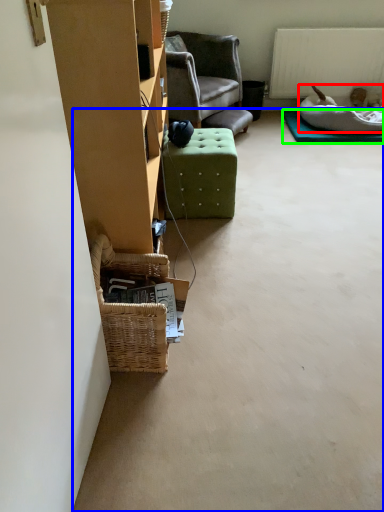
Question: Which object is the farthest from dog bed (highlighted by a red box)? Choose among these: concrete (highlighted by a blue box) or mat (highlighted by a green box).

Choices:
 (A) concrete
 (B) mat

Answer: (A)